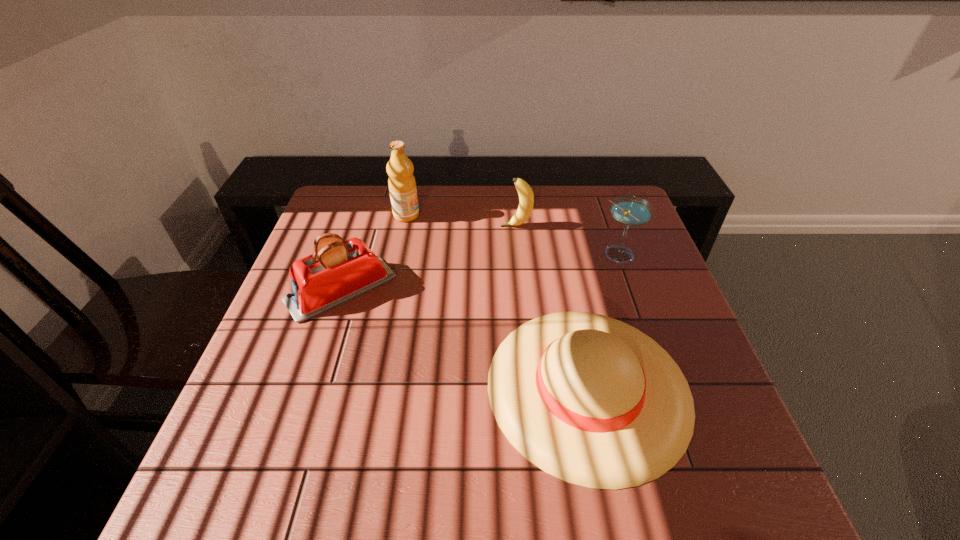
This screenshot has height=540, width=960. I want to click on fruit juice, so click(x=402, y=186).

Locate an element on the screen. This screenshot has width=960, height=540. martini is located at coordinates (631, 211).

Locate an element on the screen. The width and height of the screenshot is (960, 540). banana is located at coordinates (x=526, y=197).

The width and height of the screenshot is (960, 540). Find the location of `toaster`. toaster is located at coordinates (338, 271).

In order to click on the shortest object in this screenshot , I will do `click(589, 399)`.

Where is `vacant space located on the front label of the fruit juice`? The height and width of the screenshot is (540, 960). vacant space located on the front label of the fruit juice is located at coordinates (513, 215).

This screenshot has width=960, height=540. What are the coordinates of `vacant space located on the back of the martini` in the screenshot? It's located at (604, 214).

Identify the location of vacant space located from the stem of the banana. (388, 226).

The width and height of the screenshot is (960, 540). I want to click on vacant space located from the stem of the banana, so click(x=427, y=226).

Locate an element on the screen. vacant region located 0.050m from the stem of the banana is located at coordinates (484, 226).